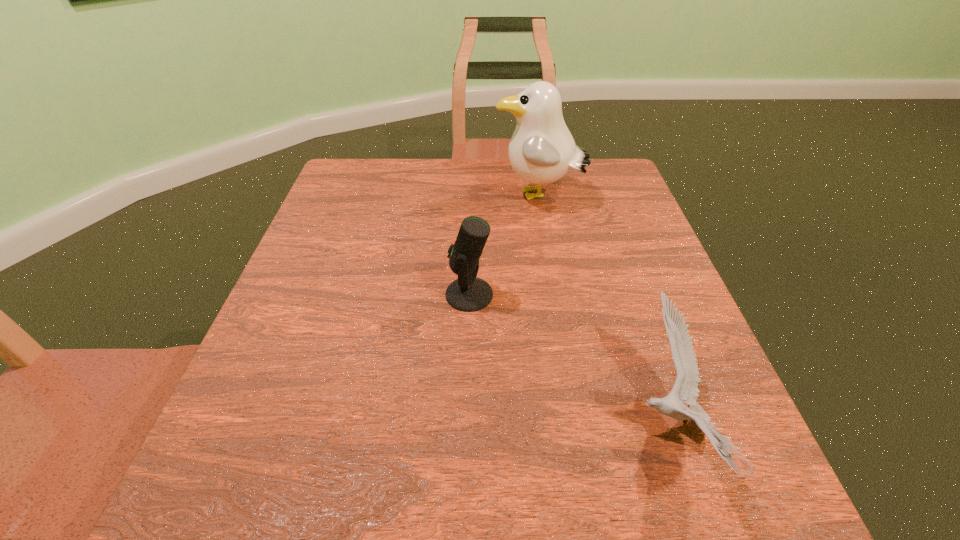
Identify the location of vacant space at the right edge of the desktop. (586, 241).

Identify the location of vacant space at the far left corner of the desktop. The width and height of the screenshot is (960, 540). (389, 168).

Locate an element on the screen. vacant area between the nearest object and the taller gull is located at coordinates (604, 312).

Where is `free spot between the microphone and the farther gull`? Image resolution: width=960 pixels, height=540 pixels. free spot between the microphone and the farther gull is located at coordinates (504, 246).

At what (x,y) coordinates should I click in order to perform the action: click on vacant region between the shorter gull and the taller gull. Please return your answer as a coordinate pair (x, y). The width and height of the screenshot is (960, 540). Looking at the image, I should click on (604, 312).

At what (x,y) coordinates should I click in order to perform the action: click on free space between the farther gull and the second farthest object. Please return your answer as a coordinate pair (x, y). The width and height of the screenshot is (960, 540). Looking at the image, I should click on (504, 246).

At what (x,y) coordinates should I click in order to perform the action: click on free space between the nearest object and the leftmost object. Please return your answer as a coordinate pair (x, y). This screenshot has width=960, height=540. Looking at the image, I should click on (569, 361).

You are a GUI agent. You are given a task and a screenshot of the screen. Output one action in this format:
    pyautogui.click(x=<x>, y=<y>)
    Task: Click on the vacant point located between the leftmost object and the farther gull
    
    Given the screenshot: What is the action you would take?
    pyautogui.click(x=504, y=246)

At what (x,y) coordinates should I click in order to perform the action: click on free space between the second nearest object and the shortest object. Please return your answer as a coordinate pair (x, y). This screenshot has height=540, width=960. Looking at the image, I should click on (569, 361).

This screenshot has width=960, height=540. I want to click on free space between the microphone and the taller gull, so click(504, 246).